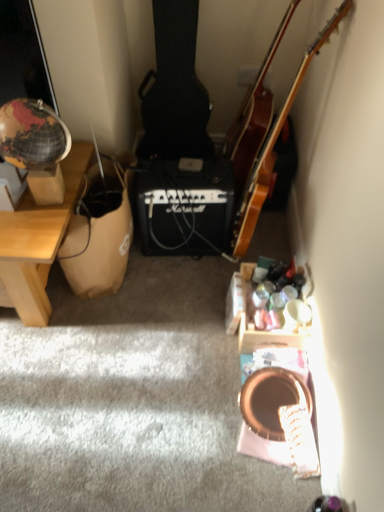
Question: Does brown paper bag at left appear on the right side of wooden acoustic guitar at upper right?

Choices:
 (A) no
 (B) yes

Answer: (A)

Question: Can you confirm if brown paper bag at left is taller than wooden acoustic guitar at upper right?

Choices:
 (A) yes
 (B) no

Answer: (B)

Question: Is brown paper bag at left wider than wooden acoustic guitar at upper right?

Choices:
 (A) no
 (B) yes

Answer: (B)

Question: From the image's perspective, is brown paper bag at left above wooden acoustic guitar at upper right?

Choices:
 (A) yes
 (B) no

Answer: (B)

Question: From a real-world perspective, is brown paper bag at left beneath wooden acoustic guitar at upper right?

Choices:
 (A) no
 (B) yes

Answer: (B)

Question: Based on their positions, is wooden acoustic guitar at upper right located to the left or right of wooden acoustic guitar at upper right?

Choices:
 (A) left
 (B) right

Answer: (B)

Question: Looking at the image, does wooden acoustic guitar at upper right seem bigger or smaller compared to wooden acoustic guitar at upper right?

Choices:
 (A) small
 (B) big

Answer: (B)

Question: From a real-world perspective, relative to wooden acoustic guitar at upper right, is wooden acoustic guitar at upper right vertically above or below?

Choices:
 (A) below
 (B) above

Answer: (B)

Question: Looking at their shapes, would you say wooden acoustic guitar at upper right is wider or thinner than wooden acoustic guitar at upper right?

Choices:
 (A) thin
 (B) wide

Answer: (B)

Question: Is wooden desk at left inside or outside of brown paper bag at left?

Choices:
 (A) outside
 (B) inside

Answer: (A)

Question: Is point (44, 326) positioned closer to the camera than point (119, 183)?

Choices:
 (A) farther
 (B) closer

Answer: (B)

Question: Considering the relative positions of wooden desk at left and brown paper bag at left in the image provided, is wooden desk at left to the left or to the right of brown paper bag at left?

Choices:
 (A) right
 (B) left

Answer: (B)

Question: In the image, is wooden desk at left positioned in front of or behind brown paper bag at left?

Choices:
 (A) behind
 (B) front

Answer: (B)

Question: In terms of height, does wooden acoustic guitar at upper right look taller or shorter compared to brown paper bag at left?

Choices:
 (A) short
 (B) tall

Answer: (B)

Question: In the image, is wooden acoustic guitar at upper right on the left side or the right side of brown paper bag at left?

Choices:
 (A) left
 (B) right

Answer: (B)